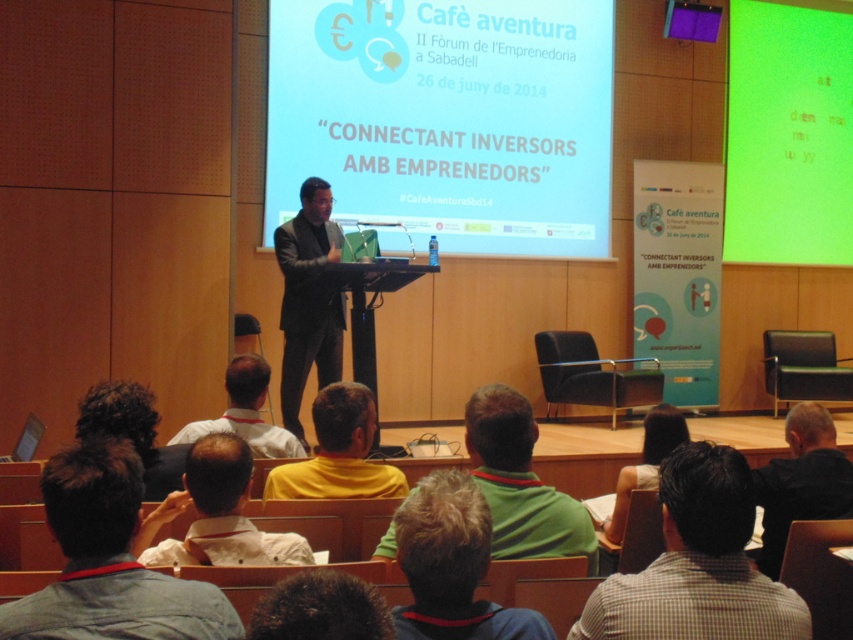
Question: Among these points, which one is nearest to the camera?

Choices:
 (A) (424, 522)
 (B) (311, 186)
 (C) (793, 468)
 (D) (318, 488)

Answer: (A)

Question: Considering the real-world distances, which object is farthest from the matte white projector screen at center?

Choices:
 (A) yellow matte shirt at center
 (B) green matte shirt at lower center

Answer: (B)

Question: Is green matte projection screen at upper right in front of dark gray suit at lower right?

Choices:
 (A) no
 (B) yes

Answer: (A)

Question: Can you confirm if dark gray suit at lower right is thinner than yellow matte shirt at center?

Choices:
 (A) no
 (B) yes

Answer: (B)

Question: Which of the following is the farthest from the observer?

Choices:
 (A) green shirt at lower center
 (B) green matte shirt at lower center
 (C) yellow matte shirt at center

Answer: (C)

Question: Does white shirt at lower center have a lesser width compared to yellow matte shirt at center?

Choices:
 (A) yes
 (B) no

Answer: (A)